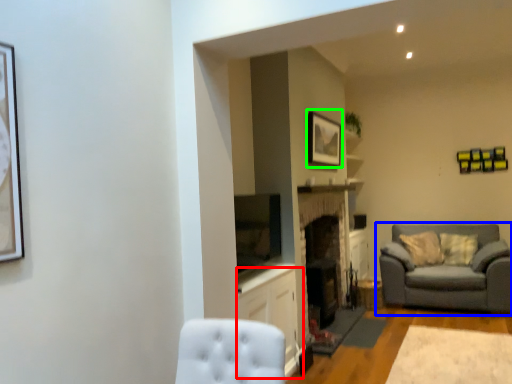
Question: Based on their relative distances, which object is farther from cabinetry (highlighted by a red box)? Choose from studio couch (highlighted by a blue box) and picture frame (highlighted by a green box).

Choices:
 (A) studio couch
 (B) picture frame

Answer: (A)